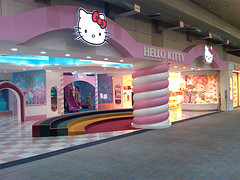
Identify the location of red rug. coord(113,125).